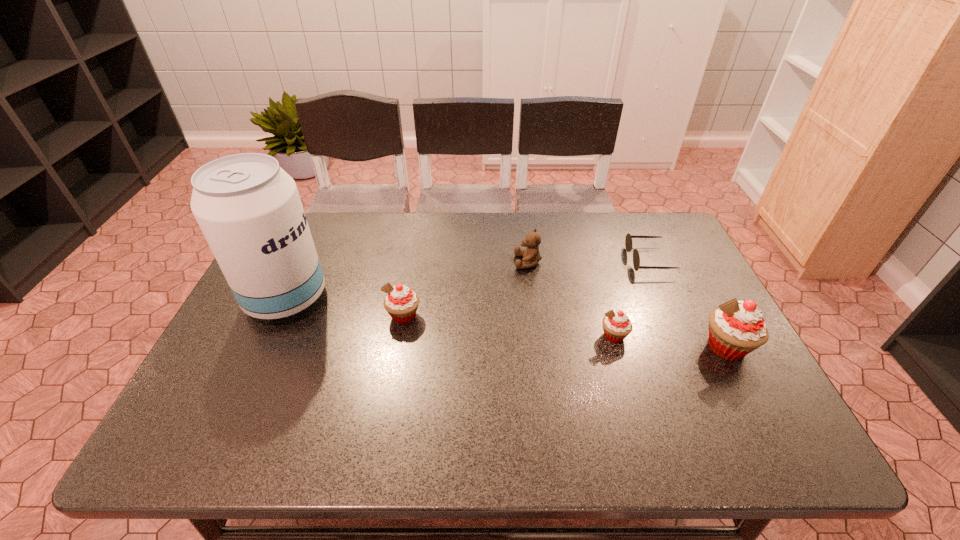
To ensure equal spacing by inserting another cupcake among them, please point out a vacant spot for this new cupcake. Please provide its 2D coordinates. Your answer should be formatted as a tuple, i.e. [(x, y)], where the tuple contains the x and y coordinates of a point satisfying the conditions above.

[(506, 326)]